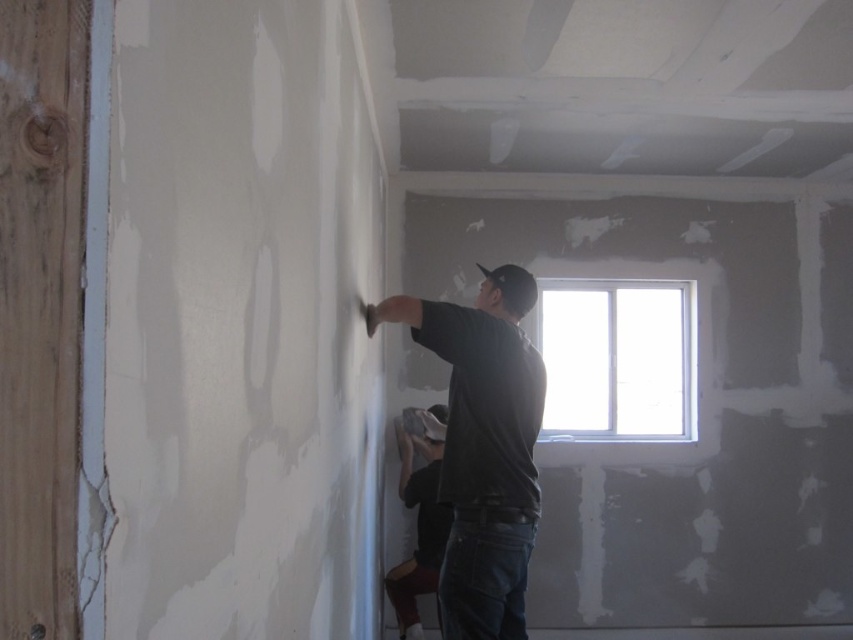
Is point (494, 474) behind point (399, 604)?

No, (494, 474) is in front of (399, 604).

Is dark gray matte shirt at center positioned before dark gray shirt at center?

Yes, it is in front of dark gray shirt at center.

You are a GUI agent. You are given a task and a screenshot of the screen. Output one action in this format:
    pyautogui.click(x=<x>, y=<y>)
    Task: Click on the dark gray matte shirt at center
    The width and height of the screenshot is (853, 640).
    Given the screenshot: What is the action you would take?
    pyautogui.click(x=483, y=448)

Is point (670, 326) farther from viewer compared to point (392, 596)?

Yes, it is behind point (392, 596).

Is clear glass window at upper center shorter than dark gray shirt at center?

Correct, clear glass window at upper center is not as tall as dark gray shirt at center.

Does point (634, 392) lie in front of point (399, 484)?

No, it is behind (399, 484).

Locate an element on the screen. clear glass window at upper center is located at coordinates (618, 356).

Between dark gray matte shirt at center and clear glass window at upper center, which one is positioned higher?

clear glass window at upper center

Where is `dark gray matte shirt at center`? dark gray matte shirt at center is located at coordinates (483, 448).